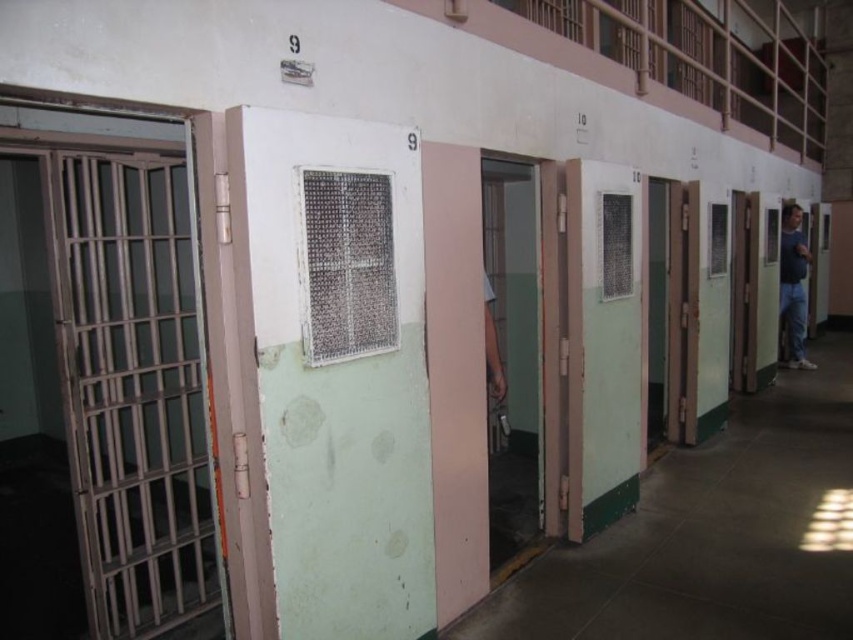
Does point (576, 385) come farther from viewer compared to point (793, 332)?

No.

Does green matte door at center appear over blue jeans at right?

Incorrect, green matte door at center is not positioned above blue jeans at right.

Identify the location of green matte door at center. The height and width of the screenshot is (640, 853). (601, 342).